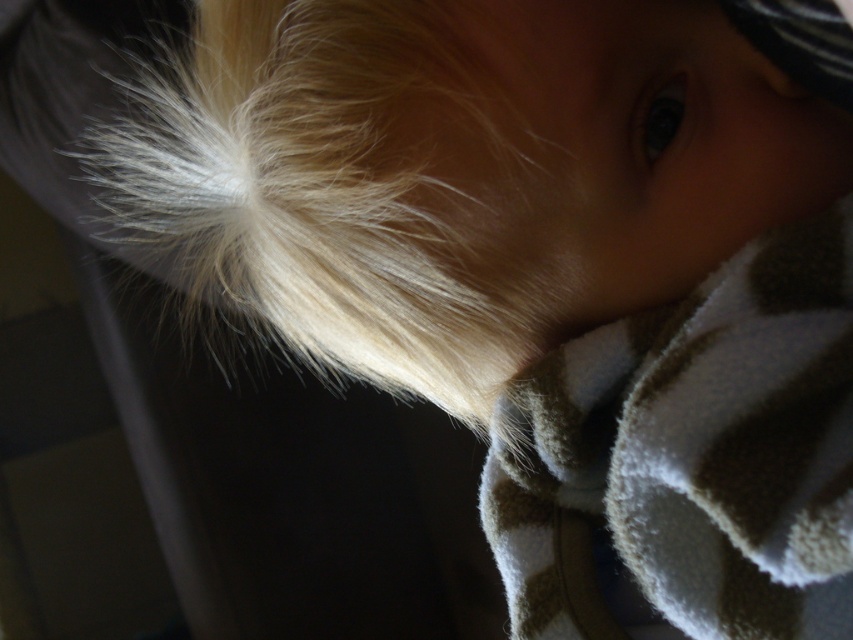
Question: Where is blonde silky hair at upper left located in relation to brown fleece blanket at lower right in the image?

Choices:
 (A) right
 (B) left

Answer: (B)

Question: Which object is closer to the camera taking this photo?

Choices:
 (A) blonde silky hair at upper left
 (B) brown fleece blanket at lower right

Answer: (B)

Question: In this image, where is blonde silky hair at upper left located relative to brown fleece blanket at lower right?

Choices:
 (A) left
 (B) right

Answer: (A)

Question: Among these points, which one is farthest from the camera?

Choices:
 (A) (506, 365)
 (B) (500, 433)

Answer: (A)

Question: Can you confirm if blonde silky hair at upper left is positioned to the right of brown fleece blanket at lower right?

Choices:
 (A) no
 (B) yes

Answer: (A)